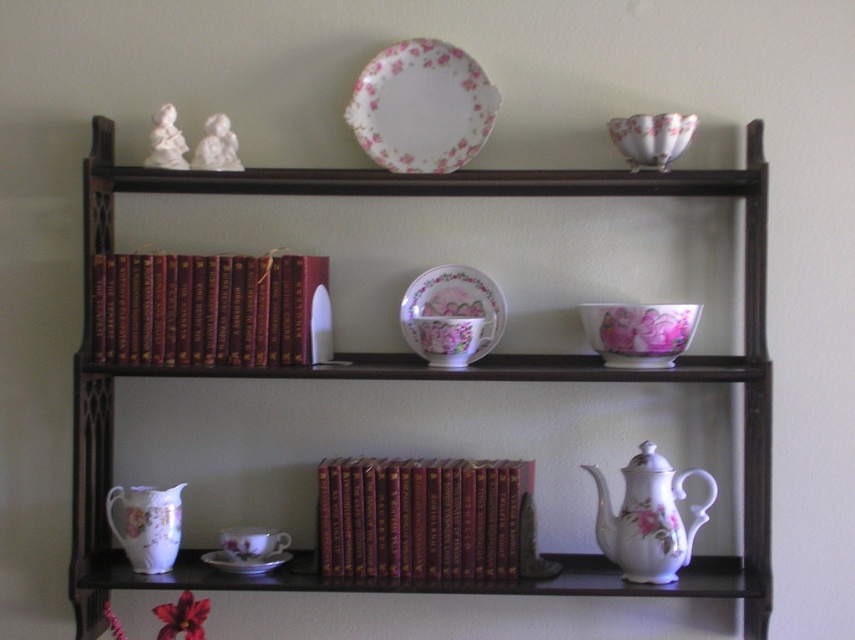
Question: Among these objects, which one is nearest to the camera?

Choices:
 (A) floral porcelain plate at upper center
 (B) maroon leather book at left

Answer: (B)

Question: Among these objects, which one is nearest to the camera?

Choices:
 (A) maroon leather book at left
 (B) matte dark wood bookshelf at center
 (C) floral porcelain plate at upper center

Answer: (B)

Question: Does matte dark wood bookshelf at center lie in front of maroon leather book at left?

Choices:
 (A) yes
 (B) no

Answer: (A)

Question: Is porcelain floral pitcher at lower left above white porcelain saucer at lower center?

Choices:
 (A) no
 (B) yes

Answer: (B)

Question: Among these objects, which one is farthest from the camera?

Choices:
 (A) porcelain floral teacup at lower center
 (B) white porcelain saucer at lower center

Answer: (A)

Question: Does porcelain floral teacup at center appear under porcelain floral teacup at lower center?

Choices:
 (A) yes
 (B) no

Answer: (B)